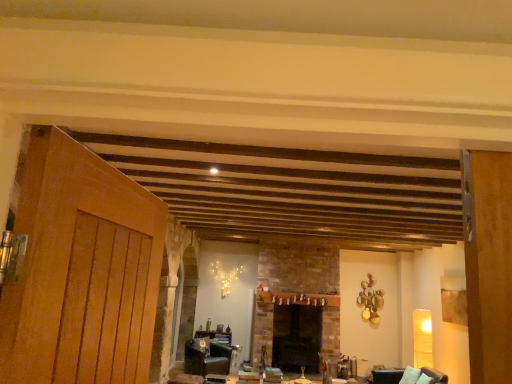
Question: Considering their positions, is dark brick fireplace at center located in front of or behind dark brown leather armchair at lower right?

Choices:
 (A) behind
 (B) front

Answer: (A)

Question: Considering the relative positions of dark brick fireplace at center and dark brown leather armchair at lower right in the image provided, is dark brick fireplace at center to the left or to the right of dark brown leather armchair at lower right?

Choices:
 (A) left
 (B) right

Answer: (A)

Question: Which is nearer to the wooden table at center?

Choices:
 (A) dark brick fireplace at center
 (B) matte black armchair at lower left
 (C) dark brown leather armchair at lower right

Answer: (B)

Question: Which is nearer to the dark brick fireplace at center?

Choices:
 (A) matte black armchair at lower left
 (B) wooden table at center
 (C) dark brown leather armchair at lower right

Answer: (B)